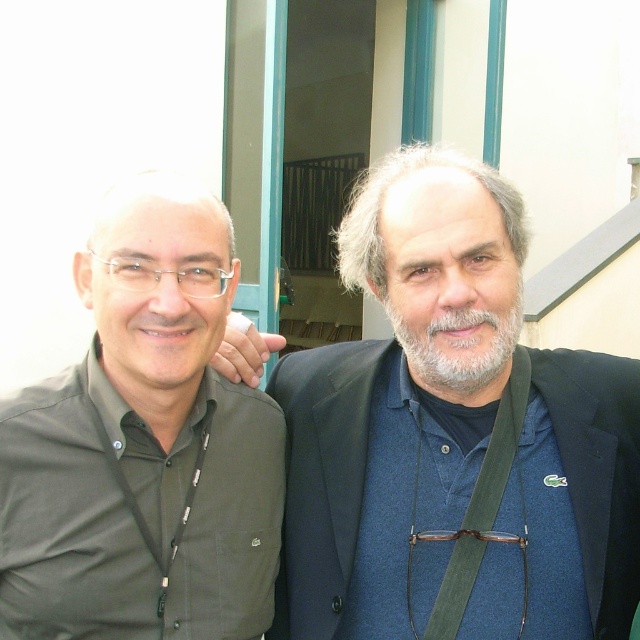
In the scene shown: Can you confirm if blue fabric shirt at center is shorter than grayhairbeard at center?

No.

Does blue fabric shirt at center have a larger size compared to grayhairbeard at center?

Indeed, blue fabric shirt at center has a larger size compared to grayhairbeard at center.

Locate an element on the screen. blue fabric shirt at center is located at coordinates (396, 388).

Which of these two, blue fabric shirt at center or green matte shirt at left, stands shorter?

Standing shorter between the two is green matte shirt at left.

This screenshot has width=640, height=640. I want to click on blue fabric shirt at center, so click(396, 388).

Which of these two, green fabric strap at center or black fabric lanyard at left, stands taller?

With more height is green fabric strap at center.

Does point (508, 392) come behind point (157, 604)?

Yes, point (508, 392) is behind point (157, 604).

Where is `green fabric strap at center`? The width and height of the screenshot is (640, 640). green fabric strap at center is located at coordinates (477, 512).